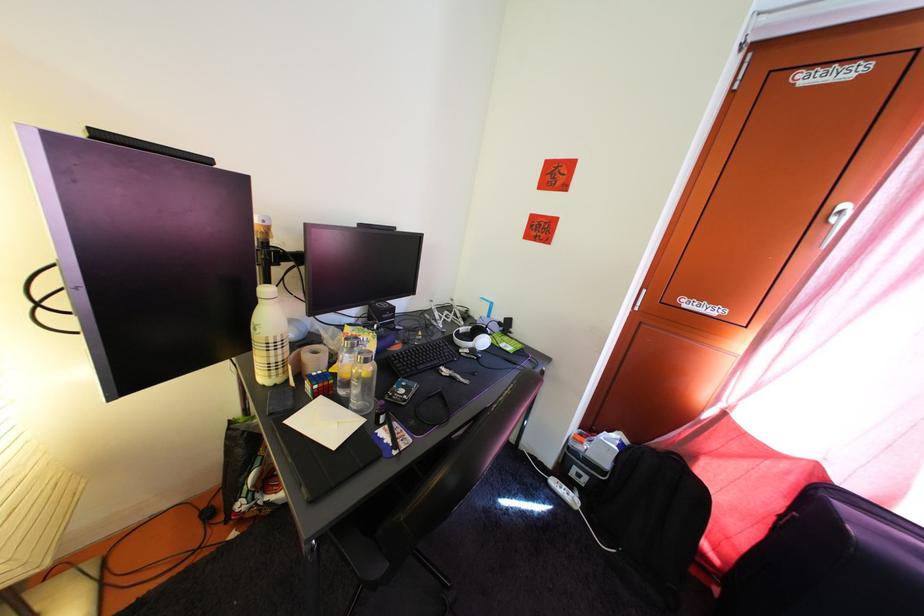
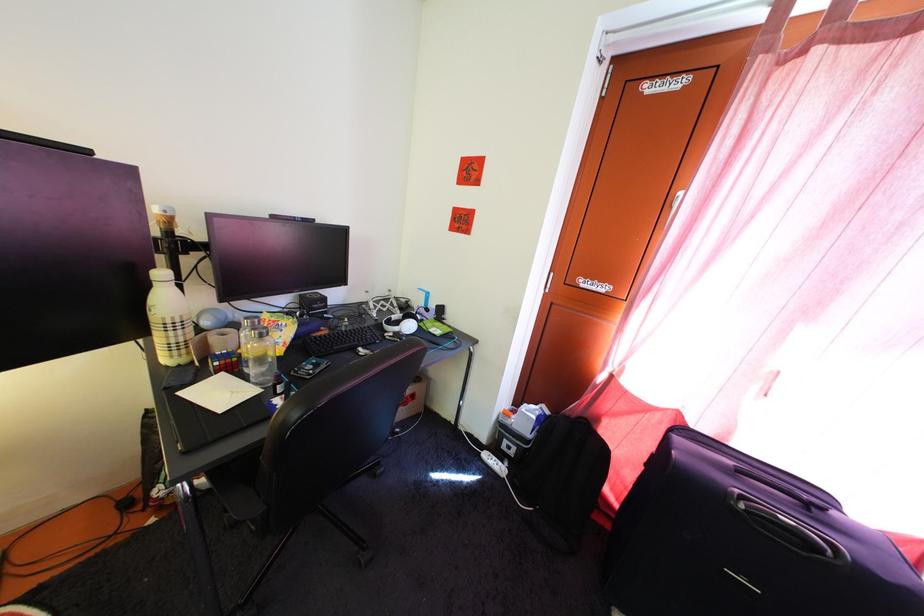
Find the pixel in the second image that matches point 369,362 in the first image.

(262, 338)